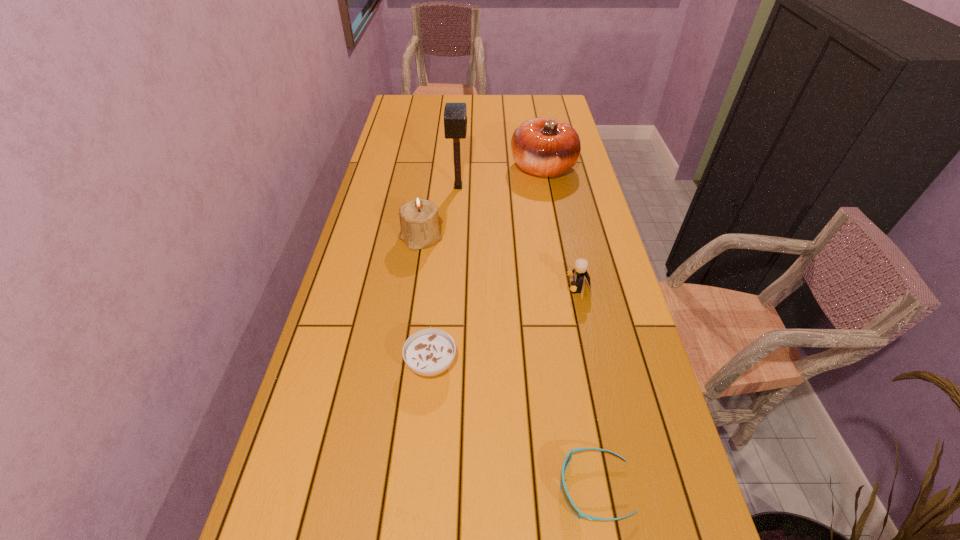
You are a GUI agent. You are given a task and a screenshot of the screen. Output one action in this format:
    pyautogui.click(x=<x>, y=<y>)
    Task: Click on the pumpkin that is at the right edge
    Image resolution: width=960 pixels, height=540 pixels.
    Given the screenshot: What is the action you would take?
    pyautogui.click(x=545, y=147)

Locate an element on the screen. This screenshot has width=960, height=540. Lego positioned at the right edge is located at coordinates (581, 265).

Locate an element on the screen. The height and width of the screenshot is (540, 960). sunglasses that is at the right edge is located at coordinates (568, 457).

This screenshot has width=960, height=540. In the image, there is a desktop. Identify the location of vacant space at the far edge. (449, 98).

I want to click on free space at the left edge of the desktop, so click(x=317, y=504).

The height and width of the screenshot is (540, 960). In the image, there is a desktop. What are the coordinates of `vacant space at the right edge` in the screenshot? It's located at (587, 352).

You are a GUI agent. You are given a task and a screenshot of the screen. Output one action in this format:
    pyautogui.click(x=<x>, y=<y>)
    Task: Click on the vacant space at the far left corner of the desktop
    This screenshot has width=960, height=540.
    Given the screenshot: What is the action you would take?
    pyautogui.click(x=396, y=106)

Locate an element on the screen. The height and width of the screenshot is (540, 960). free spot between the second nearest object and the shortest object is located at coordinates (513, 426).

I want to click on vacant area between the candle_holder and the pumpkin, so click(482, 203).

Locate an element on the screen. unoccupied area between the fifth farthest object and the nearest object is located at coordinates tap(513, 426).